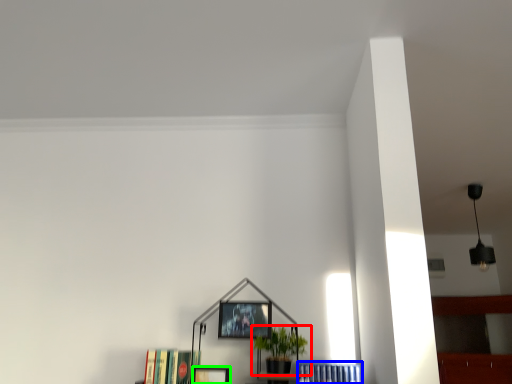
Question: Which is farther away from houseplant (highlighted by a red box)? book (highlighted by a blue box) or picture frame (highlighted by a green box)?

Choices:
 (A) book
 (B) picture frame

Answer: (B)